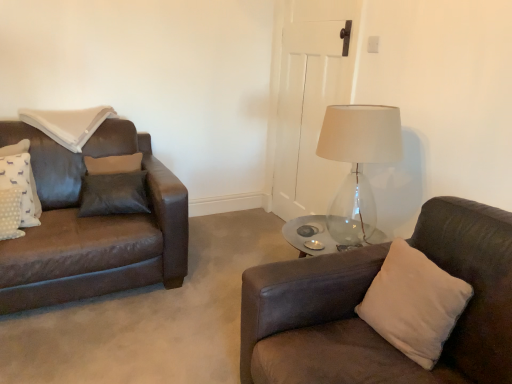
Identify the location of white fabric pillow at upper left, which is the 1th pillow in top-to-bottom order. Image resolution: width=512 pixels, height=384 pixels. (68, 124).

Is beige suede pillow at right, marked as the first pillow in a right-to-left arrangement, oriented away from white fabric pillow at upper left, which is the second pillow in left-to-right order?

No, white fabric pillow at upper left, which is the second pillow in left-to-right order, is not at the back of beige suede pillow at right, marked as the first pillow in a right-to-left arrangement.

Can you confirm if beige suede pillow at right, the third pillow in the left-to-right sequence, is shorter than white fabric pillow at upper left, placed as the first pillow when sorted from back to front?

No.

Considering the relative positions of beige suede pillow at right, which is the first pillow from bottom to top, and white fabric pillow at upper left, placed as the first pillow when sorted from back to front, in the image provided, is beige suede pillow at right, which is the first pillow from bottom to top, behind white fabric pillow at upper left, placed as the first pillow when sorted from back to front,?

That is False.

How much distance is there between beige suede pillow at right, marked as the first pillow in a right-to-left arrangement, and white fabric pillow at upper left, which is the second pillow in left-to-right order?

beige suede pillow at right, marked as the first pillow in a right-to-left arrangement, and white fabric pillow at upper left, which is the second pillow in left-to-right order, are 1.97 meters apart.

Between white fabric pillow at upper left, which is the 1th pillow in top-to-bottom order, and beige suede pillow at right, which is counted as the 3th pillow, starting from the back, which one appears on the left side from the viewer's perspective?

white fabric pillow at upper left, which is the 1th pillow in top-to-bottom order, is more to the left.

Looking at this image, is white fabric pillow at upper left, which is the 2th pillow from right to left, turned away from beige suede pillow at right, which is counted as the 3th pillow, starting from the back?

That's not correct — white fabric pillow at upper left, which is the 2th pillow from right to left, is not looking away from beige suede pillow at right, which is counted as the 3th pillow, starting from the back.

In terms of height, does white fabric pillow at upper left, placed as the first pillow when sorted from back to front, look taller or shorter compared to beige suede pillow at right, which is the first pillow from bottom to top?

In the image, white fabric pillow at upper left, placed as the first pillow when sorted from back to front, appears to be shorter than beige suede pillow at right, which is the first pillow from bottom to top.

Which object is further away from the camera, white fabric pillow at upper left, which is the 1th pillow in top-to-bottom order, or beige suede pillow at right, which is counted as the 3th pillow, starting from the back?

white fabric pillow at upper left, which is the 1th pillow in top-to-bottom order, is more distant.

Is point (81, 112) behind point (25, 218)?

Yes, point (81, 112) is behind point (25, 218).

In terms of height, does white fabric pillow at upper left, placed as the first pillow when sorted from back to front, look taller or shorter compared to white dotted fabric pillow at left, acting as the 1th pillow starting from the left?

In the image, white fabric pillow at upper left, placed as the first pillow when sorted from back to front, appears to be shorter than white dotted fabric pillow at left, acting as the 1th pillow starting from the left.

From the image's perspective, would you say white fabric pillow at upper left, placed as the first pillow when sorted from back to front, is positioned over white dotted fabric pillow at left, acting as the 1th pillow starting from the left?

Yes.

Is white fabric pillow at upper left, placed as the first pillow when sorted from back to front, turned away from white dotted fabric pillow at left, which ranks as the 2th pillow in back-to-front order?

No, white fabric pillow at upper left, placed as the first pillow when sorted from back to front, is not facing away from white dotted fabric pillow at left, which ranks as the 2th pillow in back-to-front order.

Between white dotted fabric pillow at left, which appears as the 2th pillow when ordered from the bottom, and white fabric pillow at upper left, which is the 2th pillow from right to left, which one has larger size?

With larger size is white fabric pillow at upper left, which is the 2th pillow from right to left.

What are the coordinates of `the 2nd pillow positioned below the white fabric pillow at upper left, which is the 1th pillow in top-to-bottom order (from a real-world perspective)` in the screenshot? It's located at (21, 185).

Does white dotted fabric pillow at left, placed as the second pillow when sorted from front to back, lie in front of white fabric pillow at upper left, the 3th pillow viewed from the front?

Yes, white dotted fabric pillow at left, placed as the second pillow when sorted from front to back, is closer to the viewer.

From the image's perspective, is white dotted fabric pillow at left, placed as the second pillow when sorted from front to back, positioned above or below white fabric pillow at upper left, placed as the first pillow when sorted from back to front?

white dotted fabric pillow at left, placed as the second pillow when sorted from front to back, is situated lower than white fabric pillow at upper left, placed as the first pillow when sorted from back to front, in the image.

In the scene shown: Which is more to the right, beige suede pillow at right, which is the first pillow from bottom to top, or white dotted fabric pillow at left, positioned as the second pillow in top-to-bottom order?

beige suede pillow at right, which is the first pillow from bottom to top, is more to the right.

Is point (458, 291) positioned behind point (31, 225)?

No, it is in front of (31, 225).

From a real-world perspective, is white dotted fabric pillow at left, acting as the 1th pillow starting from the left, positioned under beige suede pillow at right, acting as the 1th pillow starting from the front, based on gravity?

Indeed, from a real-world perspective, white dotted fabric pillow at left, acting as the 1th pillow starting from the left, is positioned beneath beige suede pillow at right, acting as the 1th pillow starting from the front.

Are white dotted fabric pillow at left, positioned as the second pillow in top-to-bottom order, and beige suede pillow at right, the third pillow in the left-to-right sequence, beside each other?

white dotted fabric pillow at left, positioned as the second pillow in top-to-bottom order, and beige suede pillow at right, the third pillow in the left-to-right sequence, are not in contact.

In terms of size, does white dotted fabric pillow at left, acting as the 1th pillow starting from the left, appear bigger or smaller than beige suede pillow at right, the third pillow in the top-to-bottom sequence?

Considering their sizes, white dotted fabric pillow at left, acting as the 1th pillow starting from the left, takes up less space than beige suede pillow at right, the third pillow in the top-to-bottom sequence.

Identify the location of pillow below the white dotted fabric pillow at left, which ranks as the 2th pillow in back-to-front order (from the image's perspective). Image resolution: width=512 pixels, height=384 pixels. (414, 303).

The height and width of the screenshot is (384, 512). I want to click on the 2nd pillow in front of the white fabric pillow at upper left, marked as the third pillow in a bottom-to-top arrangement, counting from the anchor's position, so click(x=414, y=303).

Where is `the 1st pillow located beneath the white fabric pillow at upper left, which is the second pillow in left-to-right order (from a real-world perspective)`? The height and width of the screenshot is (384, 512). the 1st pillow located beneath the white fabric pillow at upper left, which is the second pillow in left-to-right order (from a real-world perspective) is located at coordinates (414, 303).

From the image, which object appears to be farther from beige suede pillow at right, the third pillow in the top-to-bottom sequence, white fabric pillow at upper left, which is the 2th pillow from right to left, or white dotted fabric pillow at left, placed as the second pillow when sorted from front to back?

white fabric pillow at upper left, which is the 2th pillow from right to left, lies further to beige suede pillow at right, the third pillow in the top-to-bottom sequence, than the other object.

Based on their spatial positions, is white dotted fabric pillow at left, placed as the second pillow when sorted from front to back, or beige suede pillow at right, acting as the 1th pillow starting from the front, closer to white fabric pillow at upper left, which is the 1th pillow in top-to-bottom order?

white dotted fabric pillow at left, placed as the second pillow when sorted from front to back.

Based on their spatial positions, is beige suede pillow at right, the third pillow in the left-to-right sequence, or white dotted fabric pillow at left, placed as the second pillow when sorted from front to back, further from white fabric pillow at upper left, which is the 2th pillow from right to left?

The object further to white fabric pillow at upper left, which is the 2th pillow from right to left, is beige suede pillow at right, the third pillow in the left-to-right sequence.

Based on their spatial positions, is beige suede pillow at right, which is the first pillow from bottom to top, or white fabric pillow at upper left, which is the second pillow in left-to-right order, further from white dotted fabric pillow at left, which ranks as the 2th pillow in back-to-front order?

Based on the image, beige suede pillow at right, which is the first pillow from bottom to top, appears to be further to white dotted fabric pillow at left, which ranks as the 2th pillow in back-to-front order.

Based on their spatial positions, is white fabric pillow at upper left, which is the 2th pillow from right to left, or beige suede pillow at right, the third pillow in the top-to-bottom sequence, closer to white dotted fabric pillow at left, which ranks as the 2th pillow in back-to-front order?

white fabric pillow at upper left, which is the 2th pillow from right to left, lies closer to white dotted fabric pillow at left, which ranks as the 2th pillow in back-to-front order, than the other object.

Considering their positions, is white dotted fabric pillow at left, positioned as the second pillow in top-to-bottom order, positioned further to beige suede pillow at right, acting as the 1th pillow starting from the front, than white fabric pillow at upper left, which is the second pillow in left-to-right order?

Among the two, white fabric pillow at upper left, which is the second pillow in left-to-right order, is located further to beige suede pillow at right, acting as the 1th pillow starting from the front.

The width and height of the screenshot is (512, 384). In order to click on pillow between white dotted fabric pillow at left, positioned as the second pillow in top-to-bottom order, and beige suede pillow at right, which is counted as the 3th pillow, starting from the back, from left to right in this screenshot , I will do `click(68, 124)`.